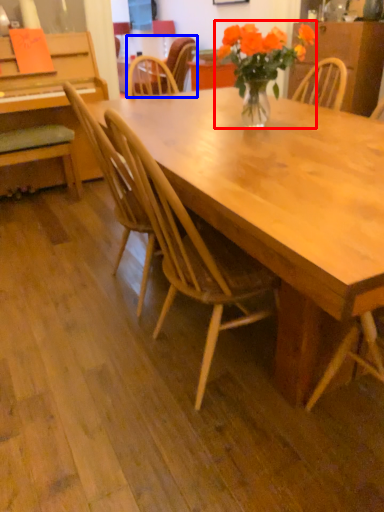
Question: Among these objects, which one is farthest to the camera, houseplant (highlighted by a red box) or chair (highlighted by a blue box)?

Choices:
 (A) houseplant
 (B) chair

Answer: (B)